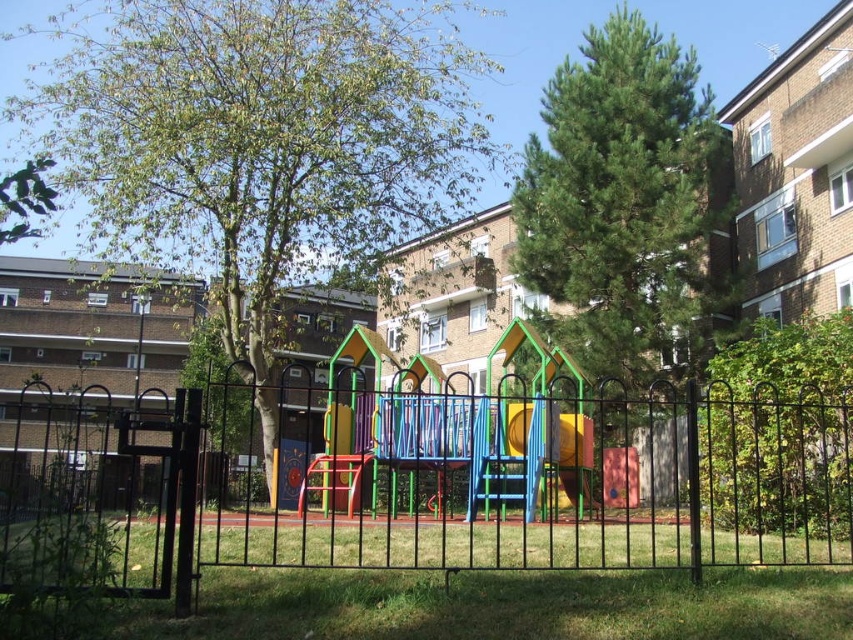
Is black metal fence at center wider than multicolored plastic slide at center?

Correct, the width of black metal fence at center exceeds that of multicolored plastic slide at center.

Can you confirm if black metal fence at center is positioned to the left of multicolored plastic slide at center?

Yes, black metal fence at center is to the left of multicolored plastic slide at center.

Locate an element on the screen. Image resolution: width=853 pixels, height=640 pixels. black metal fence at center is located at coordinates (419, 484).

Who is more forward, [219,492] or [57,29]?

Point [219,492] is in front.

How distant is black metal fence at center from green leafy tree at center?

black metal fence at center and green leafy tree at center are 5.37 meters apart from each other.

Is point (666, 412) more distant than point (279, 83)?

Yes, it is behind point (279, 83).

Where is `black metal fence at center`? black metal fence at center is located at coordinates click(x=419, y=484).

Is green leafy tree at center closer to camera compared to green textured pine tree at upper right?

That is True.

Is point (24, 104) farther from camera compared to point (641, 106)?

No, it is in front of (641, 106).

At what (x,y) coordinates should I click in order to perform the action: click on green leafy tree at center. Please return your answer as a coordinate pair (x, y). Looking at the image, I should click on (260, 141).